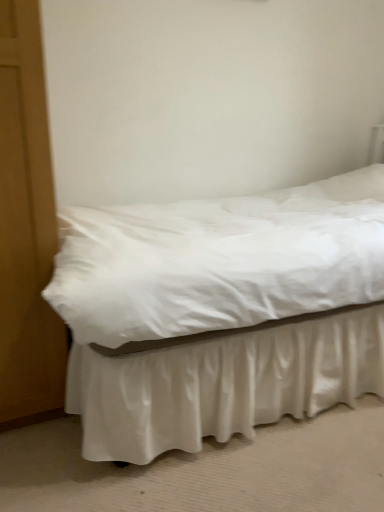
Question: Does satin white bed frame at lower center have a lesser height compared to white satin bed at center?

Choices:
 (A) no
 (B) yes

Answer: (B)

Question: Are satin white bed frame at lower center and white satin bed at center far apart?

Choices:
 (A) yes
 (B) no

Answer: (B)

Question: Is the depth of satin white bed frame at lower center greater than that of white satin bed at center?

Choices:
 (A) no
 (B) yes

Answer: (A)

Question: Would you say satin white bed frame at lower center contains white satin bed at center?

Choices:
 (A) yes
 (B) no

Answer: (B)

Question: From a real-world perspective, is satin white bed frame at lower center physically below white satin bed at center?

Choices:
 (A) yes
 (B) no

Answer: (A)

Question: Is satin white bed frame at lower center completely or partially outside of white satin bed at center?

Choices:
 (A) no
 (B) yes

Answer: (B)

Question: Can you confirm if white satin bed at center is wider than satin white bed frame at lower center?

Choices:
 (A) no
 (B) yes

Answer: (A)

Question: Is white satin bed at center positioned behind satin white bed frame at lower center?

Choices:
 (A) no
 (B) yes

Answer: (B)

Question: Considering the relative sizes of white satin bed at center and satin white bed frame at lower center in the image provided, is white satin bed at center bigger than satin white bed frame at lower center?

Choices:
 (A) yes
 (B) no

Answer: (A)

Question: Is white satin bed at center located outside satin white bed frame at lower center?

Choices:
 (A) no
 (B) yes

Answer: (B)

Question: Is white satin bed at center thinner than satin white bed frame at lower center?

Choices:
 (A) no
 (B) yes

Answer: (B)

Question: Does white satin bed at center have a greater height compared to satin white bed frame at lower center?

Choices:
 (A) no
 (B) yes

Answer: (B)

Question: Does point (142, 387) appear closer or farther from the camera than point (369, 350)?

Choices:
 (A) closer
 (B) farther

Answer: (A)